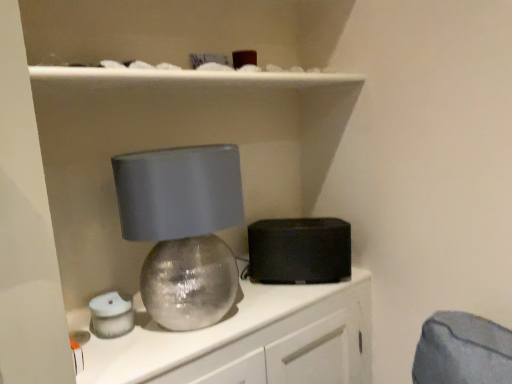
Where is `matte silver sphere at center`? The height and width of the screenshot is (384, 512). matte silver sphere at center is located at coordinates (250, 340).

Where is `black matte speaker at center`? The height and width of the screenshot is (384, 512). black matte speaker at center is located at coordinates (298, 251).

Where is `matte silver sphere at center`? matte silver sphere at center is located at coordinates (250, 340).

Who is bigger, matte silver sphere at center or matte gray lampshade at center?

matte silver sphere at center is bigger.

Considering the sizes of matte silver sphere at center and matte gray lampshade at center in the image, is matte silver sphere at center wider or thinner than matte gray lampshade at center?

Considering their sizes, matte silver sphere at center looks broader than matte gray lampshade at center.

Considering the sizes of objects matte silver sphere at center and matte gray lampshade at center in the image provided, who is shorter, matte silver sphere at center or matte gray lampshade at center?

matte gray lampshade at center is shorter.

Does matte gray lampshade at center appear on the right side of black matte speaker at center?

Incorrect, matte gray lampshade at center is not on the right side of black matte speaker at center.

From the image's perspective, would you say matte gray lampshade at center is shown under black matte speaker at center?

No, from the image's perspective, matte gray lampshade at center is not beneath black matte speaker at center.

Considering the sizes of objects matte gray lampshade at center and black matte speaker at center in the image provided, who is wider, matte gray lampshade at center or black matte speaker at center?

With larger width is matte gray lampshade at center.

Considering the relative sizes of matte gray lampshade at center and black matte speaker at center in the image provided, is matte gray lampshade at center taller than black matte speaker at center?

Indeed, matte gray lampshade at center has a greater height compared to black matte speaker at center.

Can you confirm if black matte speaker at center is shorter than matte silver sphere at center?

Yes.

Is point (323, 260) farther from viewer compared to point (228, 361)?

That is True.

Would you consider black matte speaker at center to be distant from matte silver sphere at center?

That's not correct — black matte speaker at center is a little close to matte silver sphere at center.

The width and height of the screenshot is (512, 384). In order to click on appliance on the right of matte silver sphere at center in this screenshot , I will do `click(298, 251)`.

At what (x,y) coordinates should I click in order to perform the action: click on appliance on the right of matte silver sphere at center. Please return your answer as a coordinate pair (x, y). The image size is (512, 384). Looking at the image, I should click on (298, 251).

Considering the points (170, 332) and (252, 239), which point is in front, point (170, 332) or point (252, 239)?

The point (170, 332) is closer.

How much distance is there between matte silver sphere at center and black matte speaker at center?

matte silver sphere at center and black matte speaker at center are 8.50 inches apart.

From a real-world perspective, is matte silver sphere at center physically below black matte speaker at center?

Yes, from a real-world perspective, matte silver sphere at center is below black matte speaker at center.

From the picture: Measure the distance between matte gray lampshade at center and matte silver sphere at center.

matte gray lampshade at center is 11.35 inches away from matte silver sphere at center.

Can you tell me how much matte gray lampshade at center and matte silver sphere at center differ in facing direction?

The angular difference between matte gray lampshade at center and matte silver sphere at center is 4.78 degrees.

Is matte silver sphere at center located within matte gray lampshade at center?

No, matte silver sphere at center is located outside of matte gray lampshade at center.

Considering the points (155, 230) and (179, 342), which point is behind, point (155, 230) or point (179, 342)?

The point (179, 342) is farther from the camera.

Is black matte speaker at center not near matte gray lampshade at center?

No, black matte speaker at center is in close proximity to matte gray lampshade at center.

In the scene shown: Is black matte speaker at center at the left side of matte gray lampshade at center?

No.

Which object is closer to the camera taking this photo, black matte speaker at center or matte gray lampshade at center?

matte gray lampshade at center.

The image size is (512, 384). I want to click on cabinetry located on the right of matte gray lampshade at center, so click(250, 340).

Locate an element on the screen. The image size is (512, 384). lamp above the black matte speaker at center (from the image's perspective) is located at coordinates (183, 229).

Looking at the image, which one is located closer to matte gray lampshade at center, matte silver sphere at center or black matte speaker at center?

matte silver sphere at center lies closer to matte gray lampshade at center than the other object.

From the image, which object appears to be farther from black matte speaker at center, matte silver sphere at center or matte gray lampshade at center?

matte gray lampshade at center.

Looking at the image, which one is located closer to matte silver sphere at center, matte gray lampshade at center or black matte speaker at center?

The object closer to matte silver sphere at center is black matte speaker at center.

Based on their spatial positions, is black matte speaker at center or matte gray lampshade at center closer to matte silver sphere at center?

black matte speaker at center is positioned closer to the anchor matte silver sphere at center.

Based on their spatial positions, is matte gray lampshade at center or matte silver sphere at center closer to black matte speaker at center?

matte silver sphere at center is closer to black matte speaker at center.

When comparing their distances from matte gray lampshade at center, does black matte speaker at center or matte silver sphere at center seem closer?

matte silver sphere at center.

Where is `lamp between matte silver sphere at center and black matte speaker at center from front to back`? This screenshot has height=384, width=512. lamp between matte silver sphere at center and black matte speaker at center from front to back is located at coordinates (183, 229).